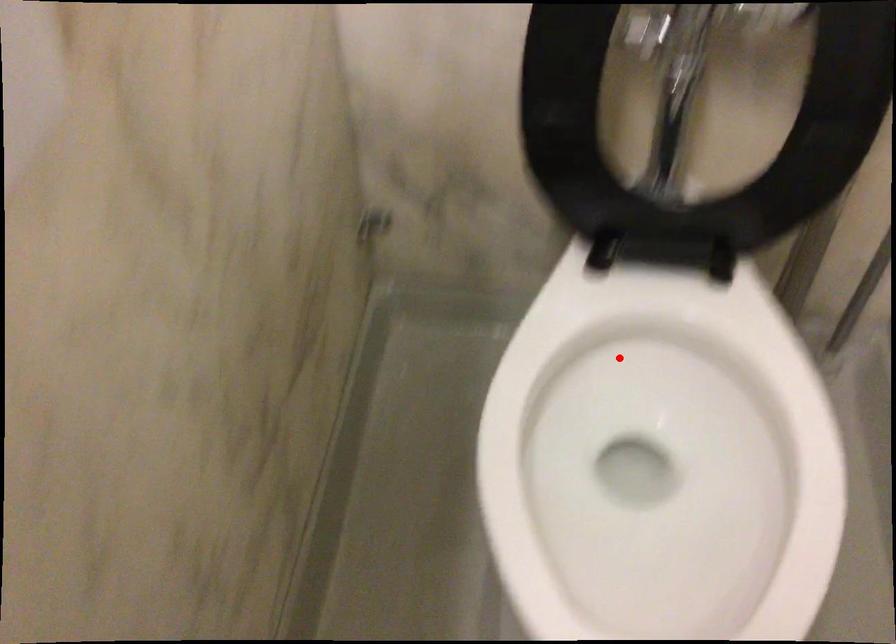
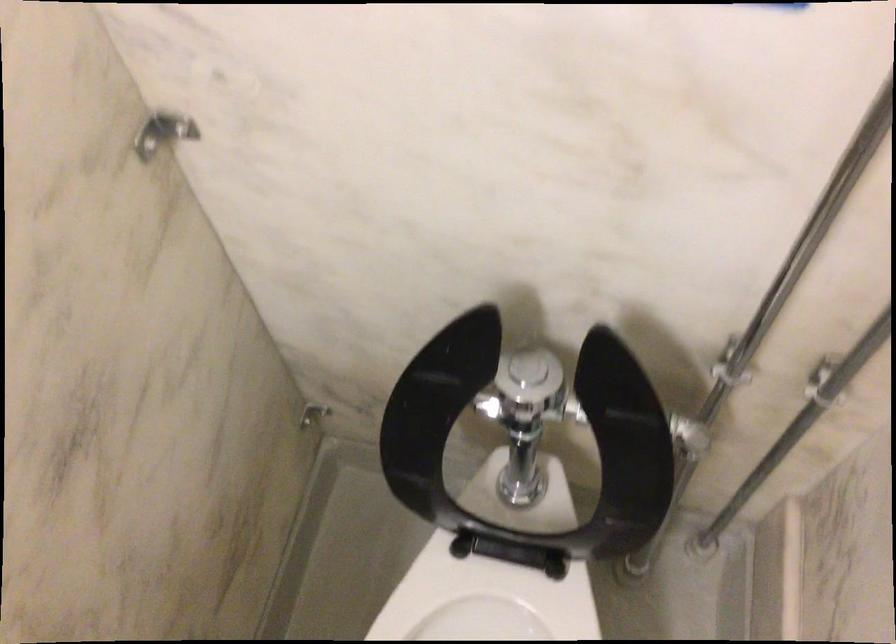
Question: I am providing you with two images of the same scene from different viewpoints. Given a red point in image1, look at the same physical point in image2. Is it:

Choices:
 (A) Closer to the viewpoint
 (B) Farther from the viewpoint

Answer: (B)